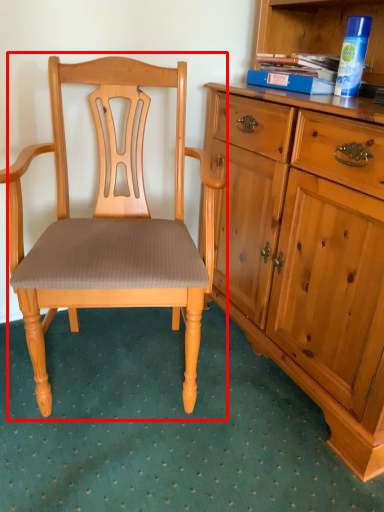
Question: From the image's perspective, considering the relative positions of chair (annotated by the red box) and book in the image provided, where is chair (annotated by the red box) located with respect to the staircase?

Choices:
 (A) below
 (B) above

Answer: (A)